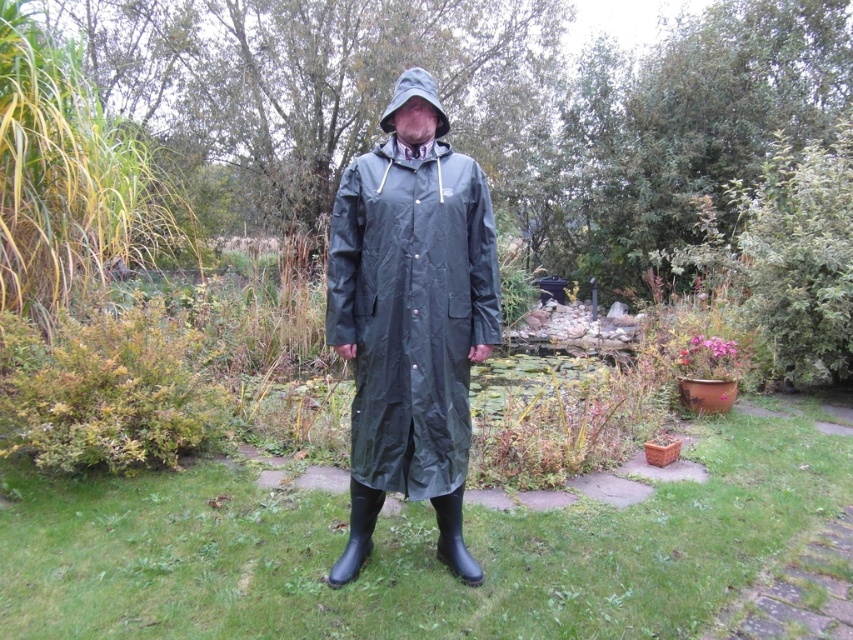
What do you see at coordinates (357, 532) in the screenshot?
I see `rubber boots at lower center` at bounding box center [357, 532].

Find the location of a particular element. The image size is (853, 640). rubber boots at lower center is located at coordinates pos(357,532).

Can you confirm if rubber boots at lower center is shorter than matte gray hood at center?

Yes, rubber boots at lower center is shorter than matte gray hood at center.

Who is more distant from viewer, (378,493) or (393,90)?

Positioned behind is point (393,90).

Locate an element on the screen. This screenshot has width=853, height=640. rubber boots at lower center is located at coordinates (357, 532).

Consider the image. Between matte black raincoat at center and rubber boots at lower center, which one has less height?

With less height is rubber boots at lower center.

Find the location of a particular element. Image resolution: width=853 pixels, height=640 pixels. matte black raincoat at center is located at coordinates (410, 317).